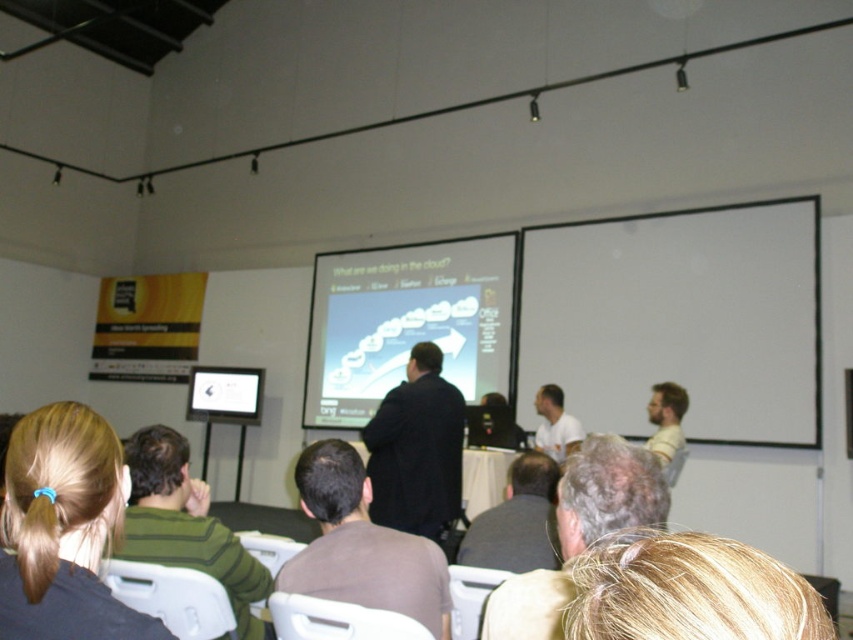
You are standing in the conference room and see the point marked at coordinates [361,545]. What object or person does this point correspond to?

The point at coordinates [361,545] corresponds to the brown matte shirt at center.

You are a presenter standing at the front of the conference room. You want to ensure that the green striped sweater at left can clearly see the white matte projection screen at upper center. Given that the minimum recommended viewing distance for the screen is 3.5 meters, is the current distance sufficient?

The distance between the white matte projection screen at upper center and the green striped sweater at left is 4.06 meters, which exceeds the minimum recommended viewing distance of 3.5 meters. Therefore, the green striped sweater at left can clearly see the white matte projection screen at upper center.